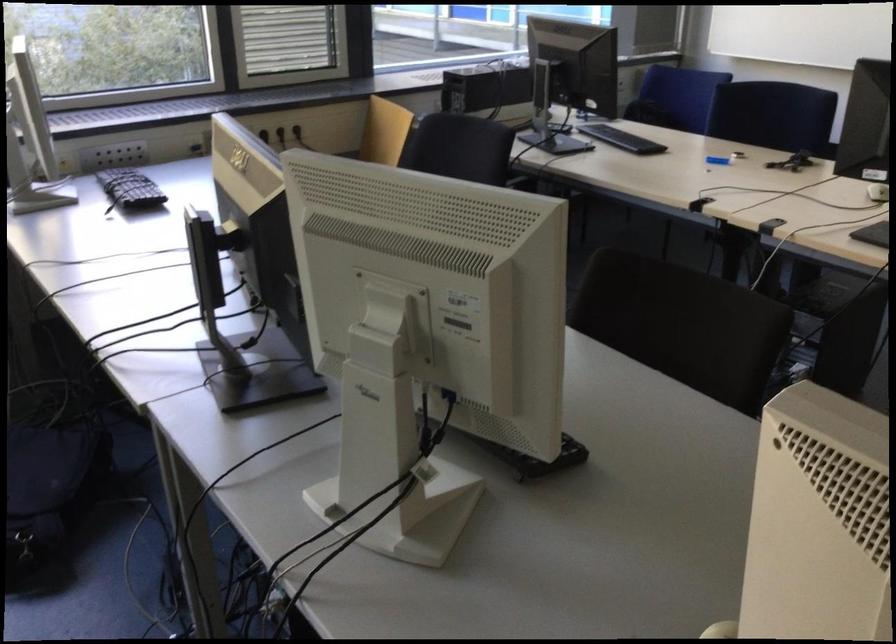
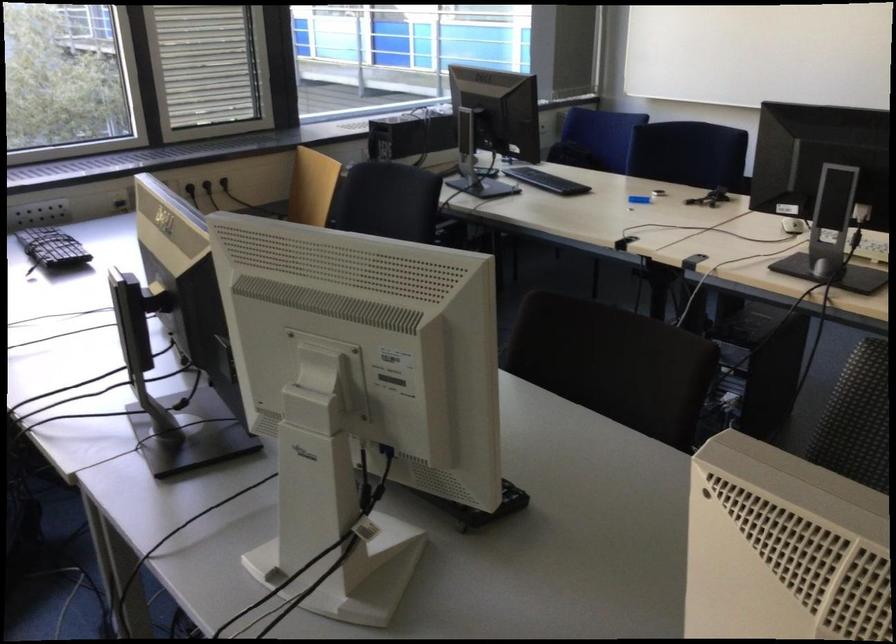
Where in the second image is the point corresponding to point 485,87 from the first image?

(411, 134)